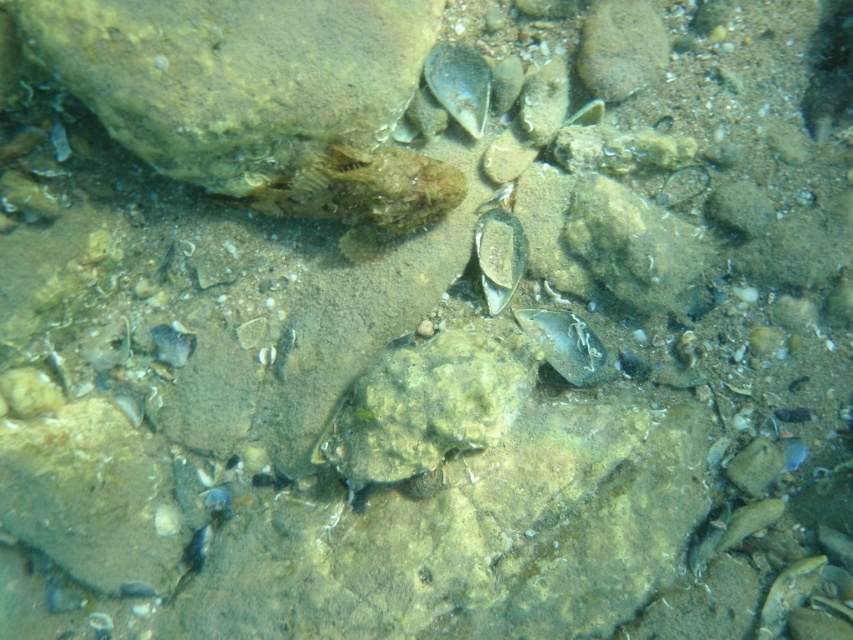
Can you confirm if shiny blue shell at upper center is taller than translucent plastic bag at center?

Correct, shiny blue shell at upper center is much taller as translucent plastic bag at center.

Is point (438, 51) closer to viewer compared to point (561, 349)?

Yes, it is in front of point (561, 349).

Where is `shiny blue shell at upper center`? The height and width of the screenshot is (640, 853). shiny blue shell at upper center is located at coordinates click(x=459, y=83).

In the scene shown: Between smooth gray shell at center and smooth gray fish at bottom right, which one has less height?

smooth gray fish at bottom right is shorter.

This screenshot has width=853, height=640. What do you see at coordinates (498, 256) in the screenshot?
I see `smooth gray shell at center` at bounding box center [498, 256].

Find the location of `smooth gray shell at center`. smooth gray shell at center is located at coordinates (498, 256).

Does point (576, 353) lie behind point (801, 592)?

No, it is not.

Does translucent plastic bag at center appear on the left side of smooth gray fish at bottom right?

Correct, you'll find translucent plastic bag at center to the left of smooth gray fish at bottom right.

Is point (602, 360) farther from camera compared to point (788, 564)?

No, (602, 360) is closer to viewer.

Image resolution: width=853 pixels, height=640 pixels. What are the coordinates of `translucent plastic bag at center` in the screenshot? It's located at (563, 342).